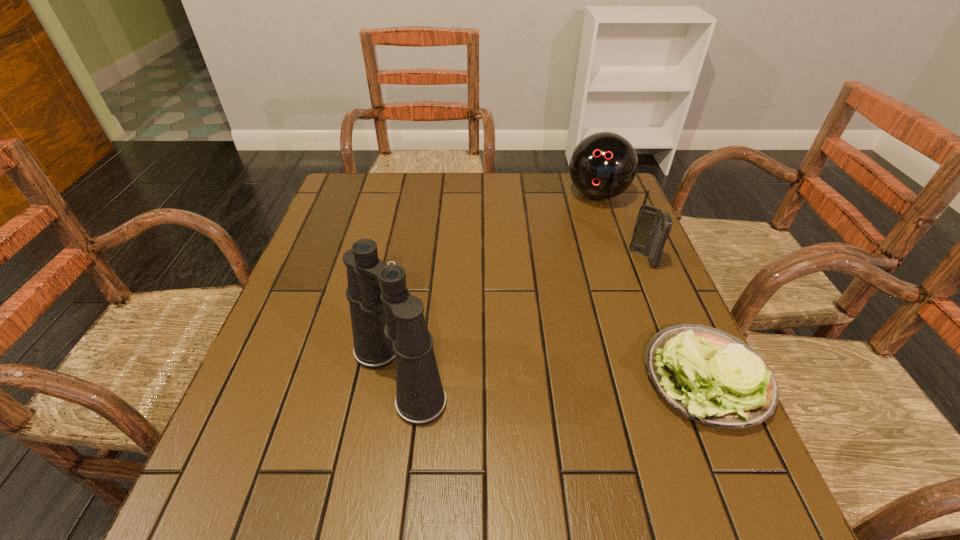
The image size is (960, 540). Identify the location of empty space between the bowling ball and the third nearest object. (620, 227).

The width and height of the screenshot is (960, 540). I want to click on free spot between the tallest object and the lettuce, so click(552, 377).

Identify the location of unoccupied position between the lettuce and the leftmost object. The height and width of the screenshot is (540, 960). (552, 377).

The width and height of the screenshot is (960, 540). Find the location of `empty space between the lettuce and the second farthest object`. empty space between the lettuce and the second farthest object is located at coordinates (675, 318).

The height and width of the screenshot is (540, 960). Find the location of `free point between the cellular telephone and the leftmost object`. free point between the cellular telephone and the leftmost object is located at coordinates (521, 318).

Where is `unoccupied area between the leftmost object and the farthest object`? unoccupied area between the leftmost object and the farthest object is located at coordinates (497, 285).

Find the location of `unoccupied position between the shortest object and the farthest object`. unoccupied position between the shortest object and the farthest object is located at coordinates (652, 286).

Where is `the third closest object to the bowling ball`? The width and height of the screenshot is (960, 540). the third closest object to the bowling ball is located at coordinates (388, 323).

I want to click on object that is the third closest to the farthest object, so click(388, 323).

What are the coordinates of `vacant space that satisfies the following two spatial constraints: 1. on the back side of the leftmost object; 2. on the right side of the cellular telephone` in the screenshot? It's located at (418, 259).